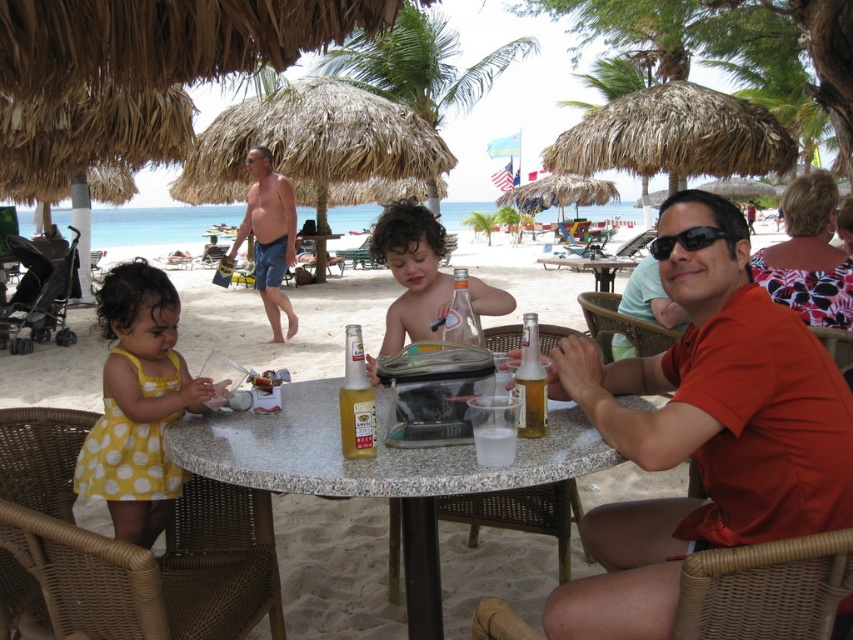
Can you confirm if matte orange shirt at center is shorter than marble table at center?

In fact, matte orange shirt at center may be taller than marble table at center.

Consider the image. Does matte orange shirt at center appear under marble table at center?

Yes.

Who is more forward, (799, 486) or (577, 259)?

Point (799, 486)

At what (x,y) coordinates should I click in order to perform the action: click on matte orange shirt at center. Please return your answer as a coordinate pair (x, y). Looking at the image, I should click on (704, 433).

Where is `white marble table at center`? Image resolution: width=853 pixels, height=640 pixels. white marble table at center is located at coordinates (357, 461).

Measure the distance between white marble table at center and black plastic sunglasses at upper right.

A distance of 36.23 inches exists between white marble table at center and black plastic sunglasses at upper right.

Between point (258, 440) and point (665, 253), which one is positioned in front?

Point (258, 440) is in front.

You are a GUI agent. You are given a task and a screenshot of the screen. Output one action in this format:
    pyautogui.click(x=<x>, y=<y>)
    Task: Click on the white marble table at center
    Image resolution: width=853 pixels, height=640 pixels.
    Given the screenshot: What is the action you would take?
    [357, 461]

Which of these two, yellow dotted dress at lower left or shiny blue shorts at center, stands shorter?

yellow dotted dress at lower left is shorter.

Can you confirm if yellow dotted dress at lower left is bigger than shiny blue shorts at center?

No.

Does point (136, 330) come in front of point (267, 316)?

Yes, point (136, 330) is in front of point (267, 316).

Where is `yellow dotted dress at lower left`? yellow dotted dress at lower left is located at coordinates (138, 403).